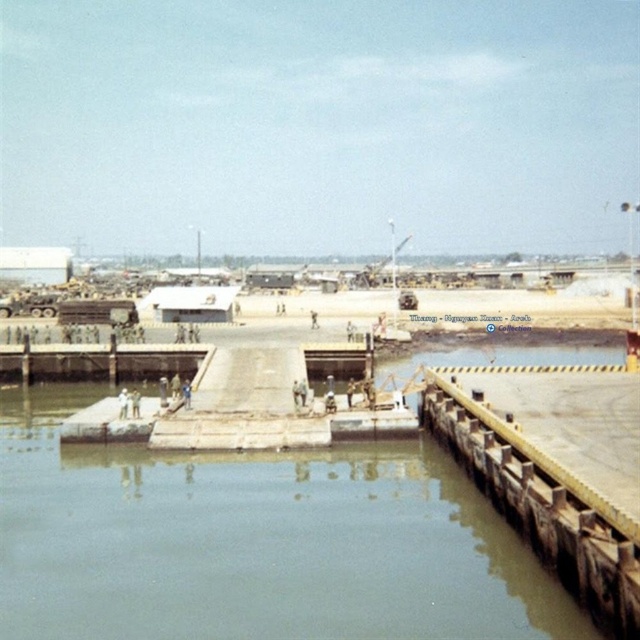
You are a sailor who needs to navigate a small boat through the harbor. The boat requires a channel at least 3 meters wide to pass safely. Looking at the clear water at center and the wooden dock at lower right, which one do you think provides a safe passage for your boat?

The clear water at center has a larger width than the wooden dock at lower right, so it is more likely to provide a safe passage for the boat as it meets the required width of at least 3 meters.